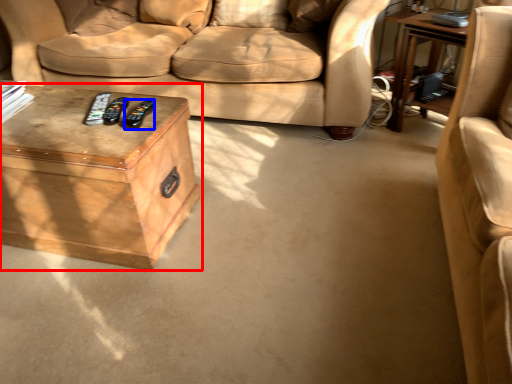
Question: Which object is further to the camera taking this photo, table (highlighted by a red box) or remote (highlighted by a blue box)?

Choices:
 (A) table
 (B) remote

Answer: (B)